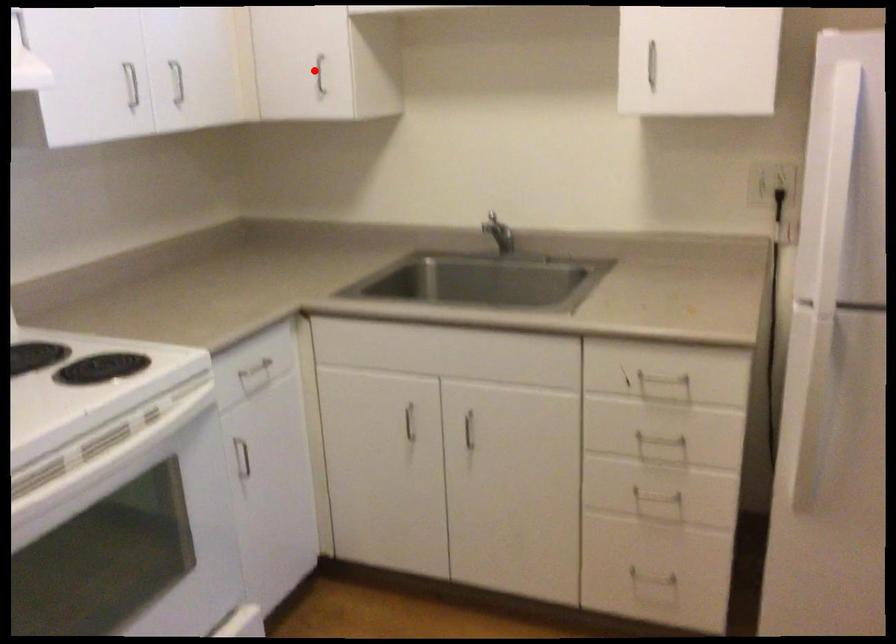
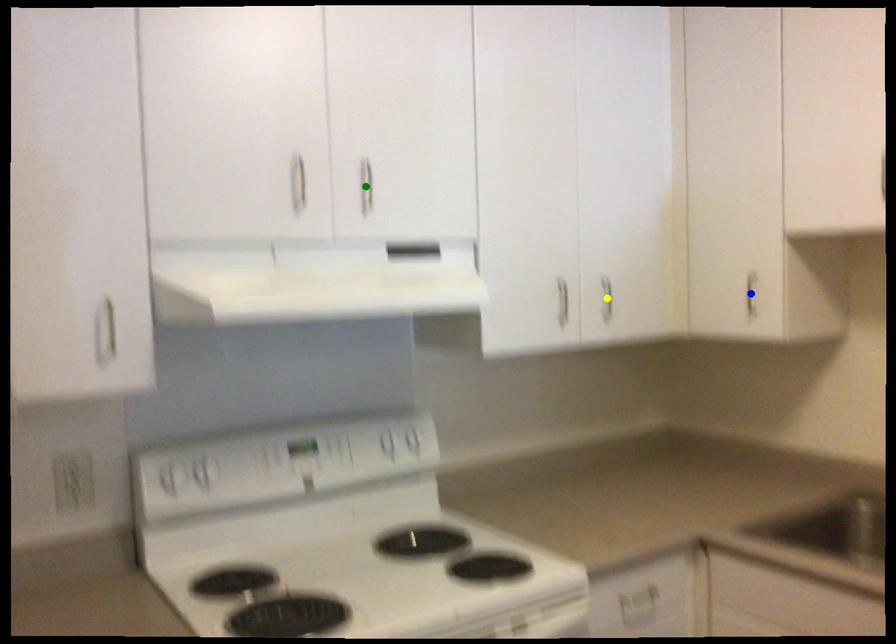
Question: I am providing you with two images of the same scene from different viewpoints. A red point is marked on the first image. You are given multiple points on the second image. Can you choose the point in image 2 that corresponds to the point in image 1?

Choices:
 (A) yellow point
 (B) blue point
 (C) green point

Answer: (B)